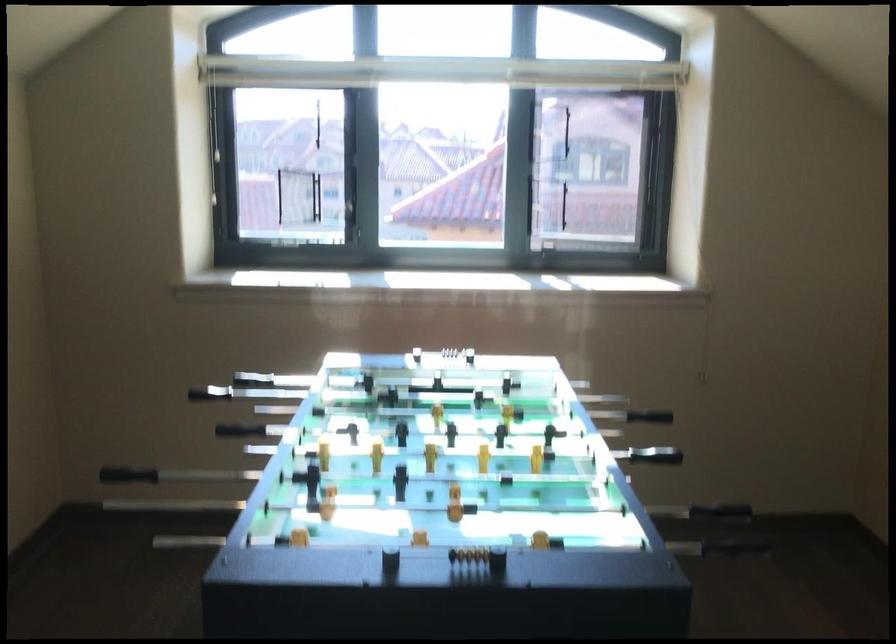
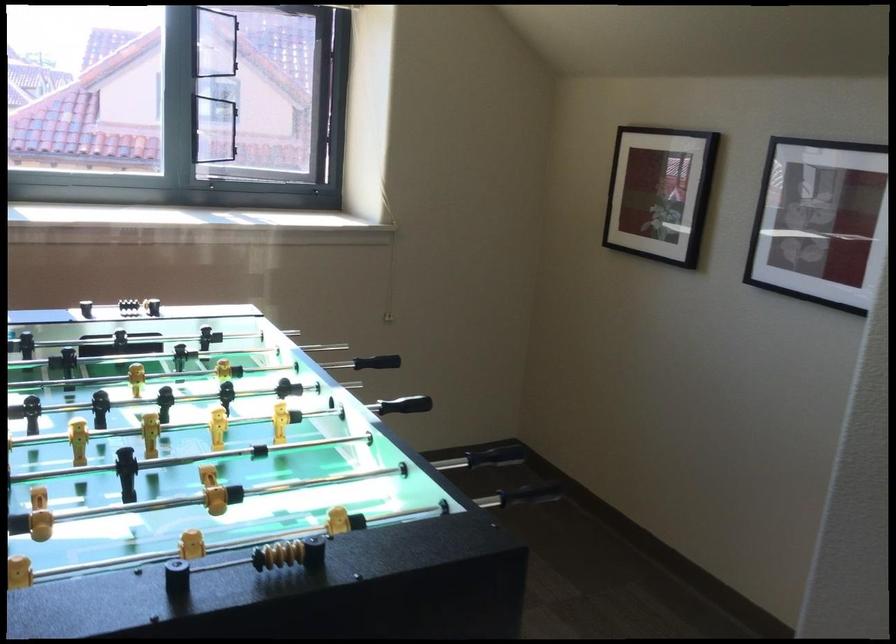
Question: The images are taken continuously from a first-person perspective. In which direction is your viewpoint rotating?

Choices:
 (A) Left
 (B) Right
 (C) Up
 (D) Down

Answer: (B)